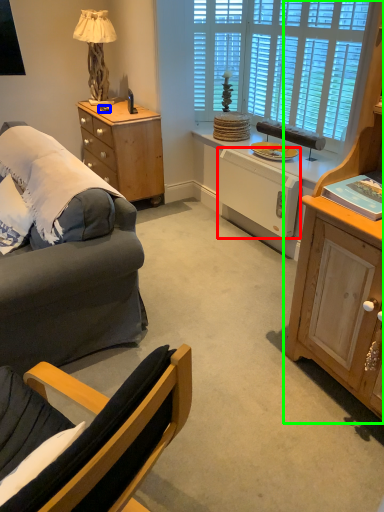
Question: Estimate the real-world distances between objects in this image. Which object is closer to appliance (highlighted by a red box), remote control (highlighted by a blue box) or cabinetry (highlighted by a green box)?

Choices:
 (A) remote control
 (B) cabinetry

Answer: (B)